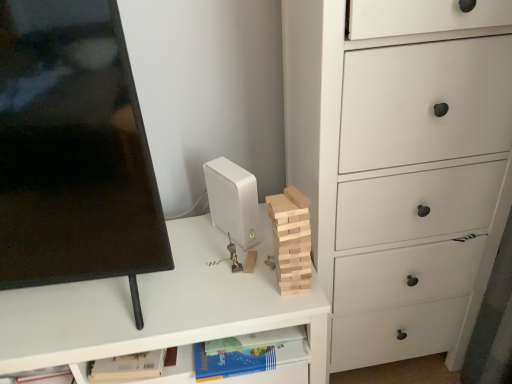
Question: Would you say white matte desktop computer at center is a long distance from white matte chest of drawers at right?

Choices:
 (A) no
 (B) yes

Answer: (A)

Question: Can you confirm if white matte desktop computer at center is bigger than white matte chest of drawers at right?

Choices:
 (A) no
 (B) yes

Answer: (A)

Question: Is white matte desktop computer at center shorter than white matte chest of drawers at right?

Choices:
 (A) no
 (B) yes

Answer: (B)

Question: Can you confirm if white matte desktop computer at center is smaller than white matte chest of drawers at right?

Choices:
 (A) yes
 (B) no

Answer: (A)

Question: Can you confirm if white matte desktop computer at center is thinner than white matte chest of drawers at right?

Choices:
 (A) no
 (B) yes

Answer: (B)

Question: In terms of size, does black glossy computer monitor at left appear bigger or smaller than natural wood block at center?

Choices:
 (A) big
 (B) small

Answer: (A)

Question: Would you say black glossy computer monitor at left is to the left or to the right of natural wood block at center in the picture?

Choices:
 (A) right
 (B) left

Answer: (B)

Question: From their relative heights in the image, would you say black glossy computer monitor at left is taller or shorter than natural wood block at center?

Choices:
 (A) tall
 (B) short

Answer: (A)

Question: From a real-world perspective, is black glossy computer monitor at left physically located above or below natural wood block at center?

Choices:
 (A) below
 (B) above

Answer: (B)

Question: Would you say blue paper book at lower center is to the left or to the right of natural wood block at center in the picture?

Choices:
 (A) right
 (B) left

Answer: (B)

Question: Is blue paper book at lower center inside or outside of natural wood block at center?

Choices:
 (A) outside
 (B) inside

Answer: (A)

Question: Is blue paper book at lower center taller or shorter than natural wood block at center?

Choices:
 (A) short
 (B) tall

Answer: (A)

Question: Considering the positions of blue paper book at lower center and natural wood block at center in the image, is blue paper book at lower center wider or thinner than natural wood block at center?

Choices:
 (A) thin
 (B) wide

Answer: (B)

Question: Is white matte desktop computer at center to the left or to the right of black glossy computer monitor at left in the image?

Choices:
 (A) right
 (B) left

Answer: (A)

Question: Is white matte desktop computer at center bigger or smaller than black glossy computer monitor at left?

Choices:
 (A) small
 (B) big

Answer: (A)